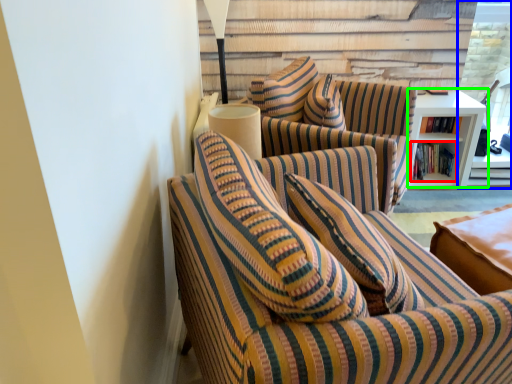
Question: Based on their relative distances, which object is farther from book (highlighted by a red box)? Choose from glass door (highlighted by a blue box) and table (highlighted by a green box).

Choices:
 (A) glass door
 (B) table

Answer: (A)